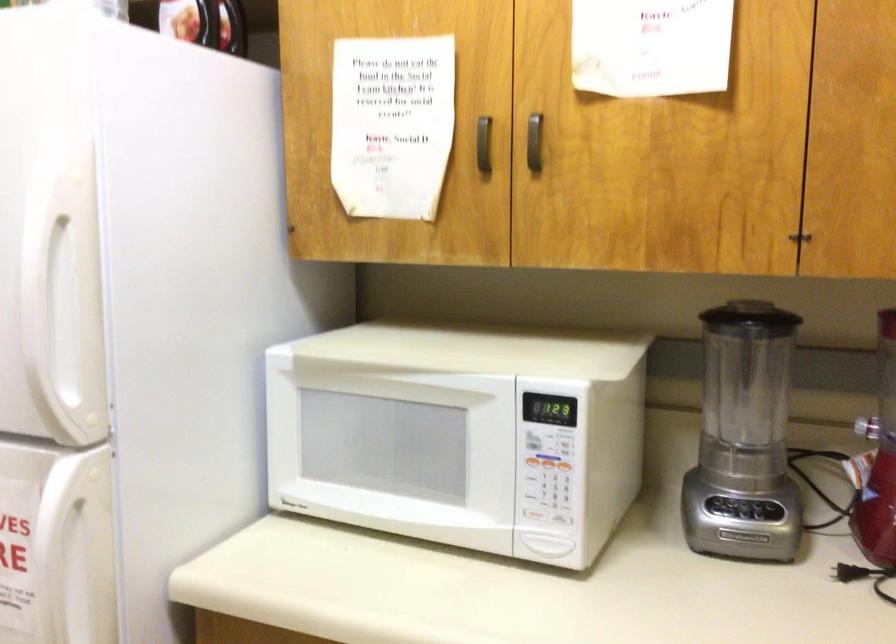
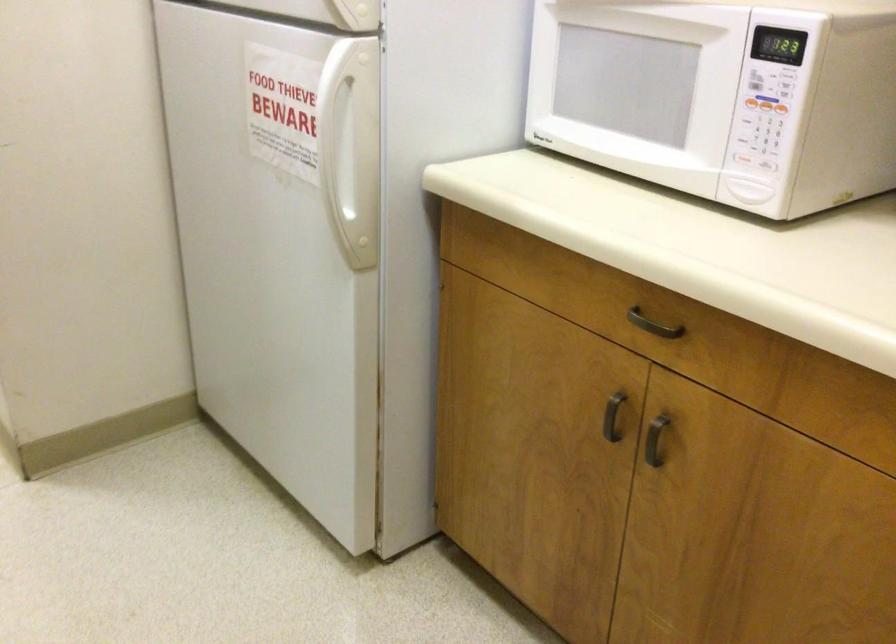
The first image is from the beginning of the video and the second image is from the end. How did the camera likely rotate when shooting the video?

The rotation direction of the camera is left-down.